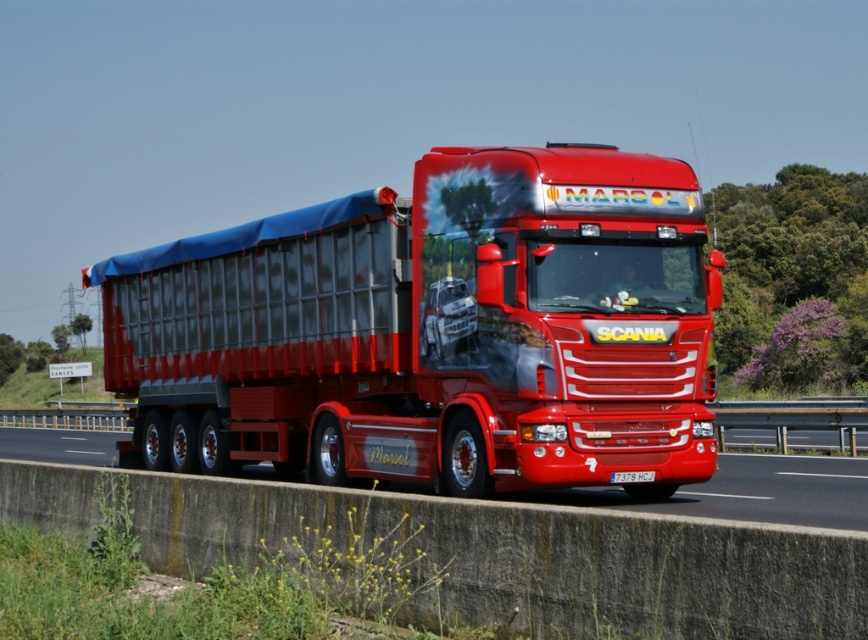
Question: Can you confirm if metallic asphalt at center is bigger than white plastic license plate at center?

Choices:
 (A) yes
 (B) no

Answer: (A)

Question: Which point is closer to the camera taking this photo?

Choices:
 (A) (329, 378)
 (B) (50, 435)

Answer: (A)

Question: Does metallic silver trailer at center have a larger size compared to white plastic license plate at center?

Choices:
 (A) yes
 (B) no

Answer: (A)

Question: Is metallic silver trailer at center to the right of white plastic license plate at center from the viewer's perspective?

Choices:
 (A) yes
 (B) no

Answer: (B)

Question: Estimate the real-world distances between objects in this image. Which object is closer to the metallic asphalt at center?

Choices:
 (A) metallic silver trailer at center
 (B) white plastic license plate at center

Answer: (A)

Question: Among these objects, which one is nearest to the camera?

Choices:
 (A) metallic silver trailer at center
 (B) white plastic license plate at center
 (C) metallic asphalt at center

Answer: (C)